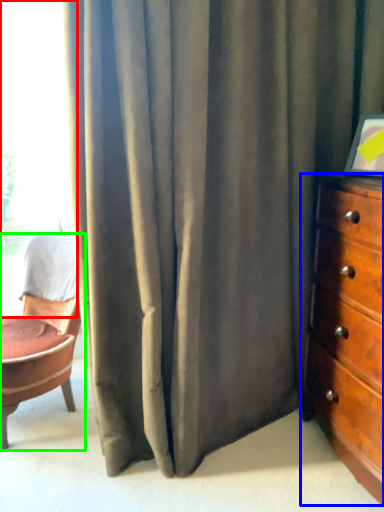
Question: Estimate the real-world distances between objects in this image. Which object is farther from window (highlighted by a red box), chest of drawers (highlighted by a blue box) or chair (highlighted by a green box)?

Choices:
 (A) chest of drawers
 (B) chair

Answer: (A)